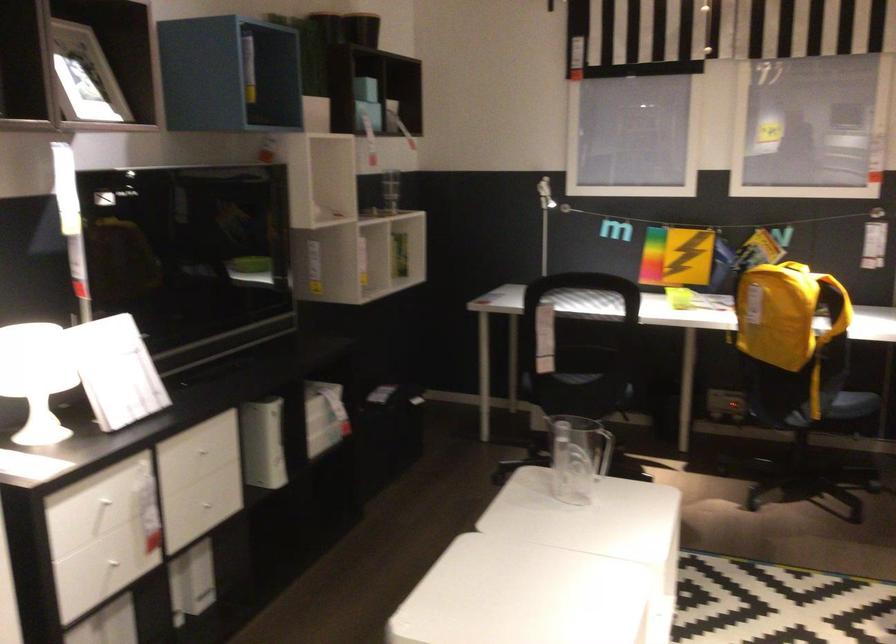
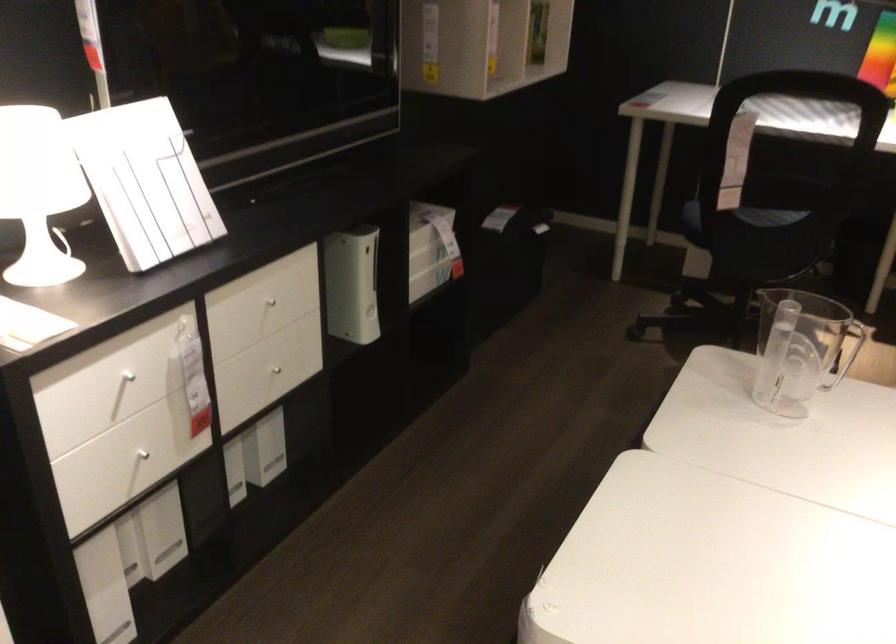
Locate, in the second image, the point that corresponds to pixel 264 444 in the first image.

(351, 285)